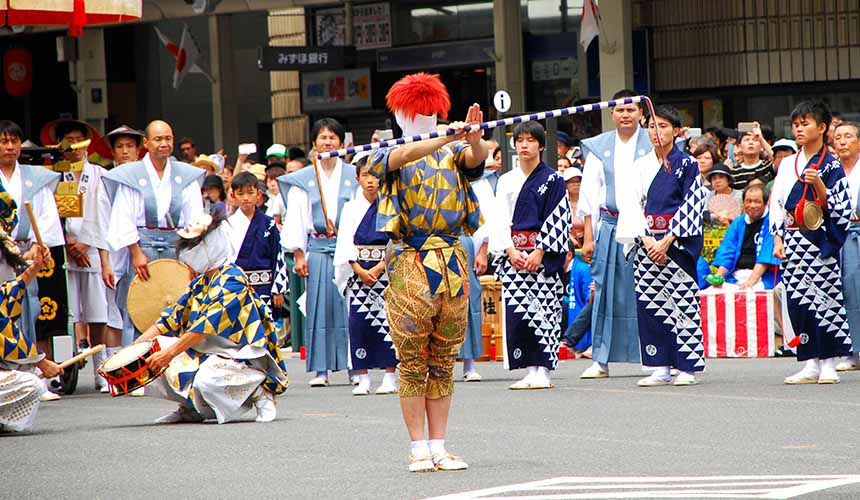
Image resolution: width=860 pixels, height=500 pixels. Find the location of `robes`. robes is located at coordinates (811, 284), (665, 286), (524, 221), (621, 165), (360, 220), (320, 188), (238, 238), (176, 206), (41, 187).